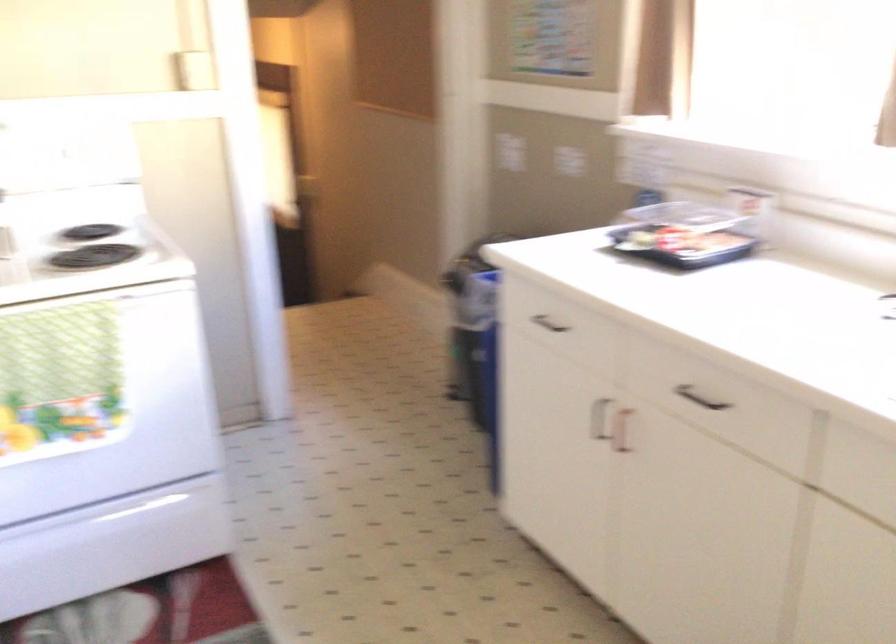
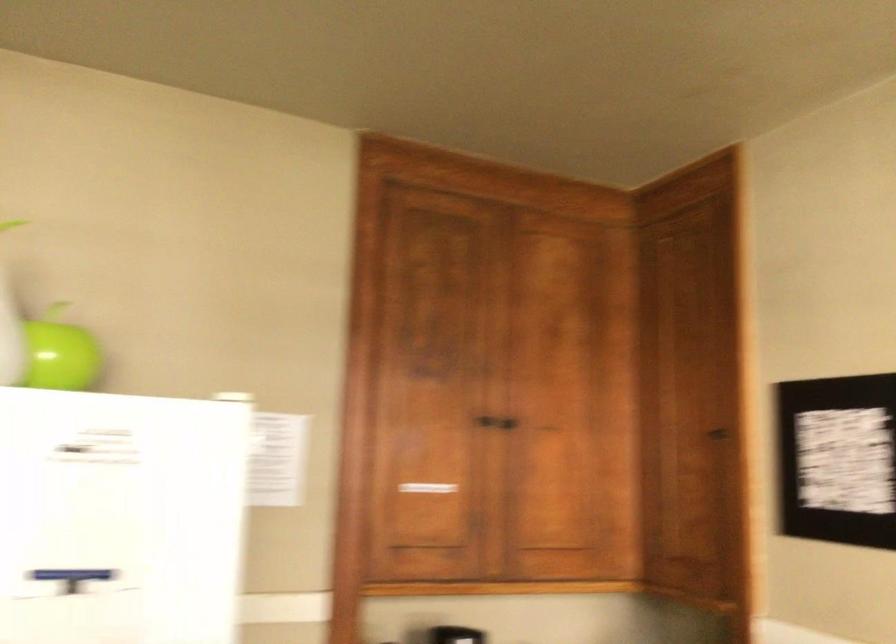
Question: The first image is from the beginning of the video and the second image is from the end. How did the camera likely rotate when shooting the video?

Choices:
 (A) Left
 (B) Right
 (C) Up
 (D) Down

Answer: (A)